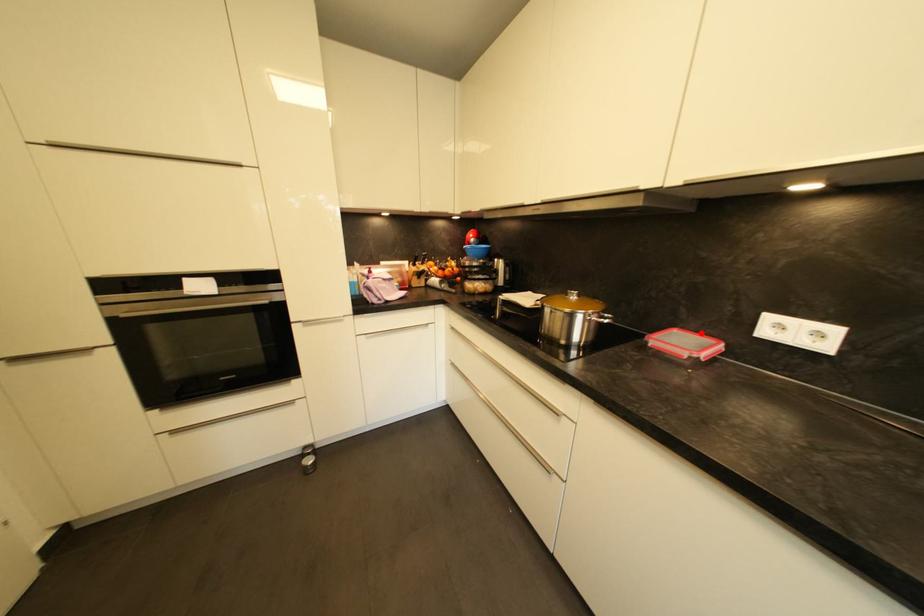
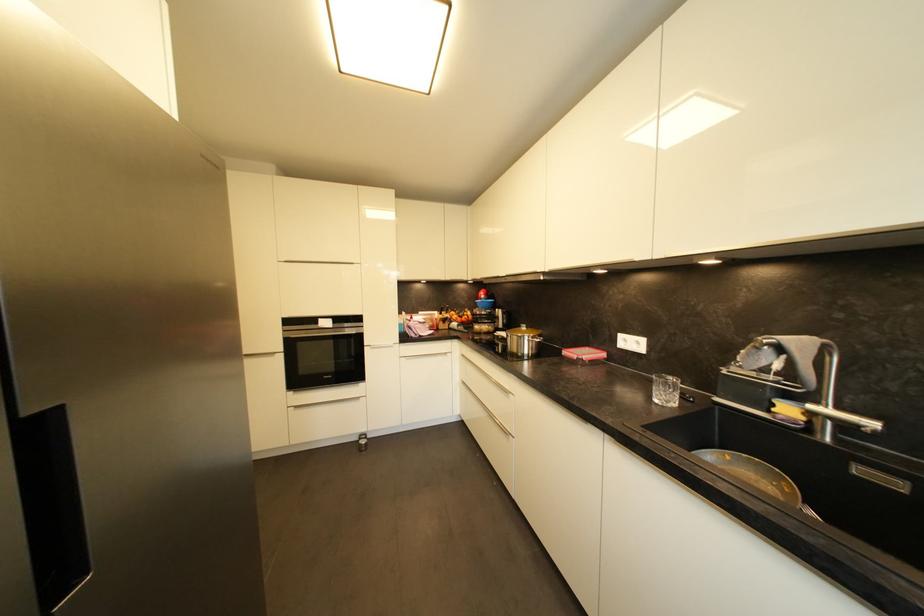
Question: I am providing you with two images of the same scene from different viewpoints. A red point is marked on the first image. At the location where the point appears in image 1, is it still visible in image 2?

Choices:
 (A) Yes
 (B) No

Answer: (A)